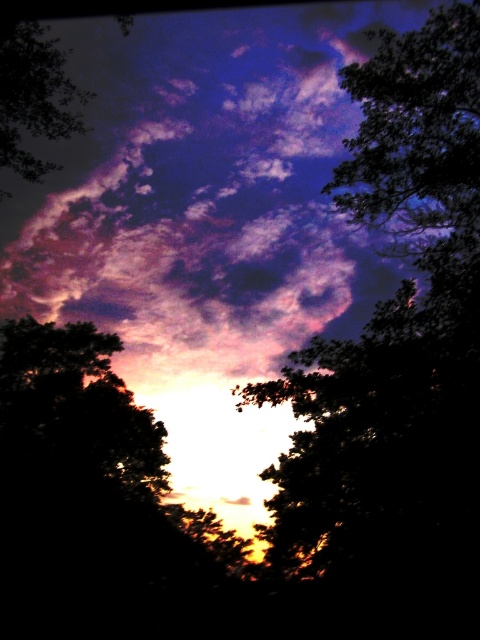
You are an artist trying to paint the sunset scene. You want to place the silhouette leafy tree at upper right and silhouette leafy tree at upper left in your painting. According to the image, which tree should be positioned to the right side of the other?

The silhouette leafy tree at upper right should be positioned to the right of the silhouette leafy tree at upper left.